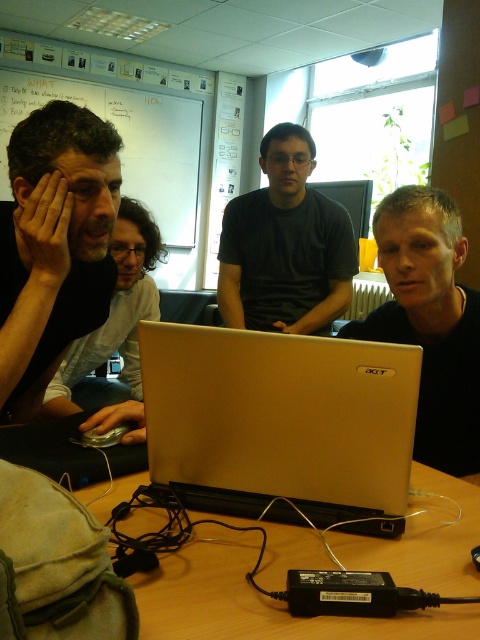
Question: Which object is farther from the camera taking this photo?

Choices:
 (A) matte black laptop at right
 (B) wooden table at lower center
 (C) dark gray shirt at center
 (D) matte black laptop at left

Answer: (C)

Question: Does wooden table at lower center lie in front of matte black laptop at left?

Choices:
 (A) no
 (B) yes

Answer: (B)

Question: Estimate the real-world distances between objects in this image. Which object is closer to the dark gray shirt at center?

Choices:
 (A) matte black laptop at left
 (B) wooden table at lower center
 (C) matte black laptop at right
 (D) matte black shirt at left

Answer: (A)

Question: Observing the image, what is the correct spatial positioning of satin gold laptop at center in reference to matte black laptop at right?

Choices:
 (A) above
 (B) below

Answer: (B)

Question: Among these points, which one is farthest from the camera?

Choices:
 (A) (124, 221)
 (B) (175, 593)
 (C) (412, 300)
 (D) (9, 320)

Answer: (A)

Question: Considering the relative positions of satin gold laptop at center and matte black laptop at left in the image provided, where is satin gold laptop at center located with respect to matte black laptop at left?

Choices:
 (A) above
 (B) below

Answer: (B)